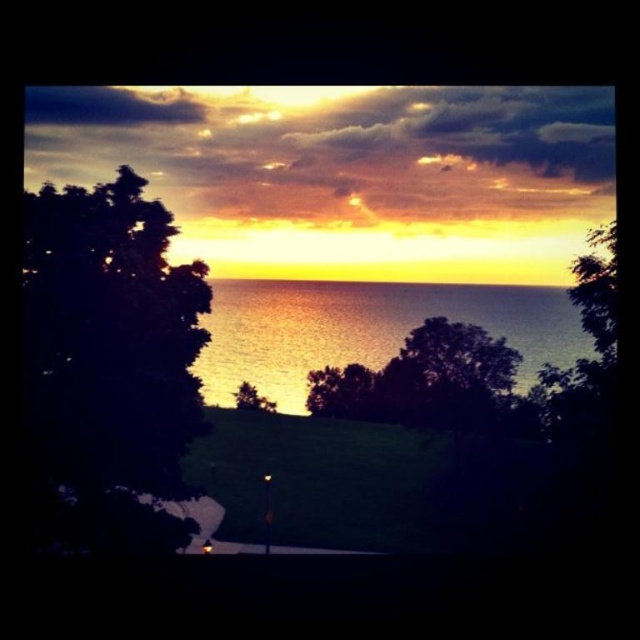
How much distance is there between dark green leafy tree at left and shiny metallic water at center?

They are 24.75 inches apart.

Is dark green leafy tree at left in front of shiny metallic water at center?

Yes, dark green leafy tree at left is closer to the viewer.

Who is more forward, (173, 397) or (221, 385)?

Point (173, 397)

Find the location of a particular element. dark green leafy tree at left is located at coordinates (108, 368).

Is point (148, 440) more distant than point (266, 401)?

No, (148, 440) is closer to viewer.

Who is taller, dark green leafy tree at left or green leafy tree at center?

With more height is dark green leafy tree at left.

Is point (125, 384) positioned before point (260, 404)?

Yes.

You are a GUI agent. You are given a task and a screenshot of the screen. Output one action in this format:
    pyautogui.click(x=<x>, y=<y>)
    Task: Click on the dark green leafy tree at left
    
    Given the screenshot: What is the action you would take?
    pyautogui.click(x=108, y=368)

Is shiny metallic water at center to the left of green leafy tree at center from the viewer's perspective?

Result: In fact, shiny metallic water at center is to the right of green leafy tree at center.

Who is taller, shiny metallic water at center or green leafy tree at center?

With more height is shiny metallic water at center.

Locate an element on the screen. This screenshot has width=640, height=640. shiny metallic water at center is located at coordinates (365, 330).